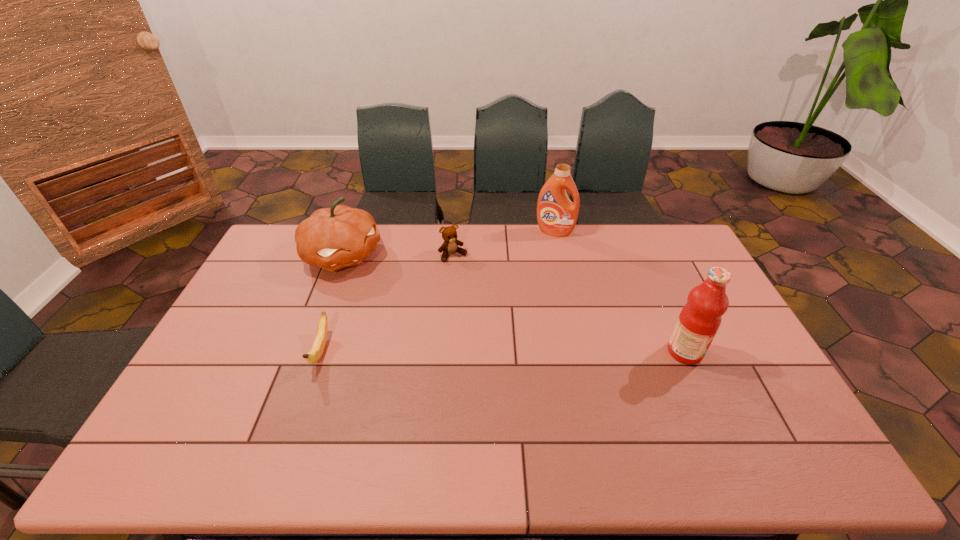
Identify the location of object at the left edge. (332, 238).

Locate an element on the screen. object present at the right edge is located at coordinates (699, 320).

Locate an element on the screen. The image size is (960, 540). object that is positioned at the far left corner is located at coordinates (332, 238).

Identify the location of vacant space at the far edge of the desktop. The image size is (960, 540). (489, 226).

The height and width of the screenshot is (540, 960). What are the coordinates of `vacant space at the near edge of the desktop` in the screenshot? It's located at (325, 403).

Find the location of a particular element. This screenshot has height=540, width=960. vacant space at the left edge of the desktop is located at coordinates (257, 310).

Locate an element on the screen. free location at the far left corner is located at coordinates (260, 261).

Find the location of a particular element. Image resolution: width=960 pixels, height=540 pixels. vacant space at the near left corner of the desktop is located at coordinates (228, 403).

Identify the location of free space that is in between the third tallest object and the rightmost object. The image size is (960, 540). (514, 304).

Identify the location of blank region between the second object from right to left and the third object from left to right. This screenshot has width=960, height=540. (504, 244).